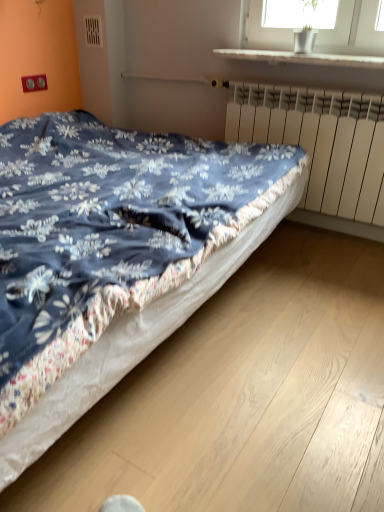
Find the location of `white glossy window sill at upper center`. white glossy window sill at upper center is located at coordinates (304, 57).

Image resolution: width=384 pixels, height=512 pixels. Identify the location of blue floral fabric bed at center. (113, 256).

Measure the distance between point [343,190] and camera.

They are 6.66 feet apart.

Locate an element on the screen. The width and height of the screenshot is (384, 512). white glossy window sill at upper center is located at coordinates (304, 57).

Are white glossy window sill at upper center and white matte radiator at right beside each other?

No, white glossy window sill at upper center is not beside white matte radiator at right.

Considering the relative sizes of white glossy window sill at upper center and white matte radiator at right in the image provided, is white glossy window sill at upper center wider than white matte radiator at right?

Yes, white glossy window sill at upper center is wider than white matte radiator at right.

From the image's perspective, does white glossy window sill at upper center appear lower than white matte radiator at right?

No, from the image's perspective, white glossy window sill at upper center is not below white matte radiator at right.

Is white glossy window sill at upper center turned away from white matte radiator at right?

white glossy window sill at upper center does not have its back to white matte radiator at right.

Is blue floral fabric bed at center wider than white glossy window sill at upper center?

Correct, the width of blue floral fabric bed at center exceeds that of white glossy window sill at upper center.

Is white glossy window sill at upper center completely or partially inside blue floral fabric bed at center?

Actually, white glossy window sill at upper center is outside blue floral fabric bed at center.

Considering the relative sizes of blue floral fabric bed at center and white glossy window sill at upper center in the image provided, is blue floral fabric bed at center shorter than white glossy window sill at upper center?

In fact, blue floral fabric bed at center may be taller than white glossy window sill at upper center.

Does blue floral fabric bed at center appear on the left side of white matte radiator at right?

Yes.

From a real-world perspective, is blue floral fabric bed at center below white matte radiator at right?

Indeed, from a real-world perspective, blue floral fabric bed at center is positioned beneath white matte radiator at right.

Can you see blue floral fabric bed at center touching white matte radiator at right?

There is a gap between blue floral fabric bed at center and white matte radiator at right.

Considering the relative positions of blue floral fabric bed at center and white matte radiator at right in the image provided, is blue floral fabric bed at center in front of white matte radiator at right?

Yes, it is in front of white matte radiator at right.

Which object is further away from the camera taking this photo, white matte radiator at right or white glossy window sill at upper center?

white matte radiator at right is behind.

Between point (271, 91) and point (304, 60), which one is positioned behind?

The point (271, 91) is farther from the camera.

Does white matte radiator at right have a larger size compared to white glossy window sill at upper center?

Yes.

Is white matte radiator at right touching blue floral fabric bed at center?

white matte radiator at right and blue floral fabric bed at center are not in contact.

In terms of height, does white matte radiator at right look taller or shorter compared to blue floral fabric bed at center?

In the image, white matte radiator at right appears to be shorter than blue floral fabric bed at center.

Is white matte radiator at right not inside blue floral fabric bed at center?

Absolutely, white matte radiator at right is external to blue floral fabric bed at center.

Between white matte radiator at right and blue floral fabric bed at center, which one has smaller width?

With smaller width is white matte radiator at right.

Is white glossy window sill at upper center directly adjacent to blue floral fabric bed at center?

Result: No, white glossy window sill at upper center is not next to blue floral fabric bed at center.

Is point (305, 57) behind point (108, 207)?

Yes.

Considering the relative sizes of white glossy window sill at upper center and blue floral fabric bed at center in the image provided, is white glossy window sill at upper center taller than blue floral fabric bed at center?

In fact, white glossy window sill at upper center may be shorter than blue floral fabric bed at center.

Where is `radiator below the white glossy window sill at upper center (from the image's perspective)`? The height and width of the screenshot is (512, 384). radiator below the white glossy window sill at upper center (from the image's perspective) is located at coordinates (320, 142).

Locate an element on the screen. The image size is (384, 512). window sill that is above the blue floral fabric bed at center (from a real-world perspective) is located at coordinates (304, 57).

Based on their spatial positions, is blue floral fabric bed at center or white matte radiator at right closer to white glossy window sill at upper center?

The object closer to white glossy window sill at upper center is white matte radiator at right.

Based on their spatial positions, is white glossy window sill at upper center or white matte radiator at right further from blue floral fabric bed at center?

Among the two, white glossy window sill at upper center is located further to blue floral fabric bed at center.

Based on their spatial positions, is white glossy window sill at upper center or blue floral fabric bed at center closer to white matte radiator at right?

white glossy window sill at upper center is closer to white matte radiator at right.

Looking at the image, which one is located further to white glossy window sill at upper center, white matte radiator at right or blue floral fabric bed at center?

blue floral fabric bed at center.

Looking at the image, which one is located closer to blue floral fabric bed at center, white matte radiator at right or white glossy window sill at upper center?

white matte radiator at right is positioned closer to the anchor blue floral fabric bed at center.

When comparing their distances from white matte radiator at right, does blue floral fabric bed at center or white glossy window sill at upper center seem closer?

white glossy window sill at upper center lies closer to white matte radiator at right than the other object.

Locate an element on the screen. This screenshot has height=512, width=384. window sill located between blue floral fabric bed at center and white matte radiator at right in the depth direction is located at coordinates (304, 57).